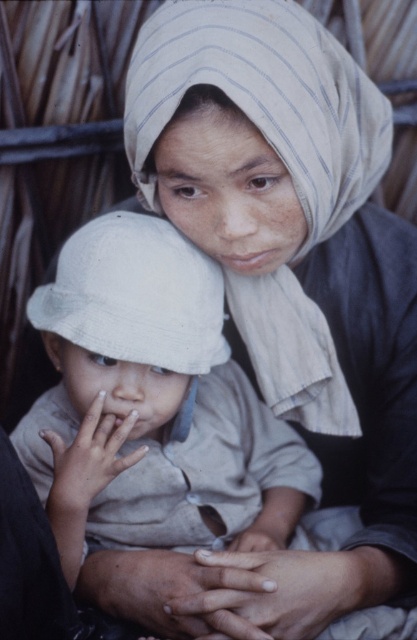
Question: Which point appears farthest from the camera in this image?

Choices:
 (A) (176, 314)
 (B) (145, 346)

Answer: (A)

Question: Where is white cotton hat at center located in relation to white fabric hat at center in the image?

Choices:
 (A) below
 (B) above

Answer: (A)

Question: Does white cotton hat at center appear over white fabric hat at center?

Choices:
 (A) yes
 (B) no

Answer: (B)

Question: Can you confirm if white cotton hat at center is smaller than white fabric hat at center?

Choices:
 (A) no
 (B) yes

Answer: (A)